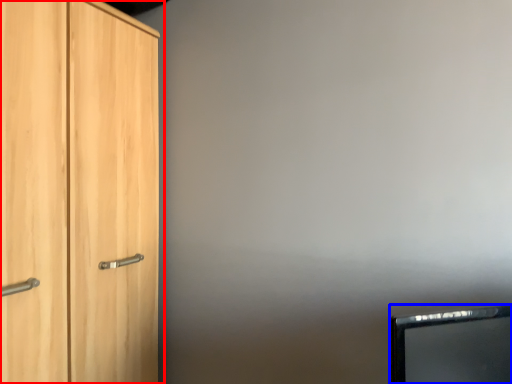
Question: Which of the following is the farthest to the observer, cupboard (highlighted by a red box) or computer monitor (highlighted by a blue box)?

Choices:
 (A) cupboard
 (B) computer monitor

Answer: (A)